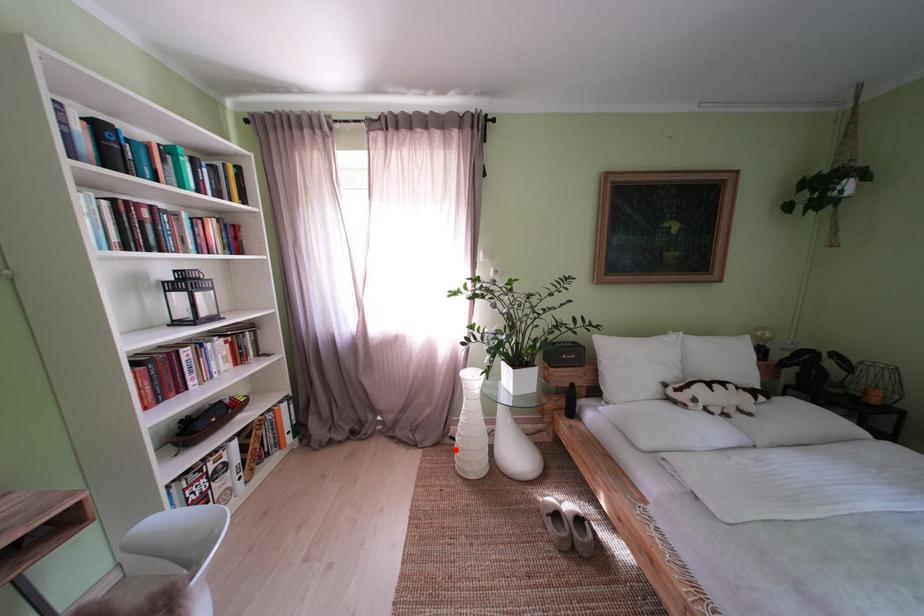
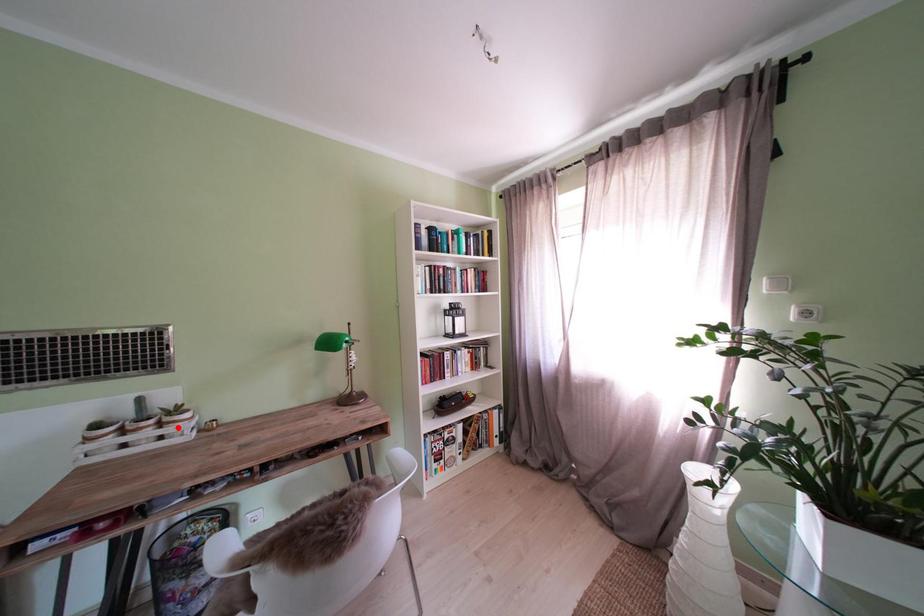
I am providing you with two images of the same scene from different viewpoints. A red point is marked on the first image and another point is marked on the second image. Is the red point in image1 aligned with the point shown in image2?

No